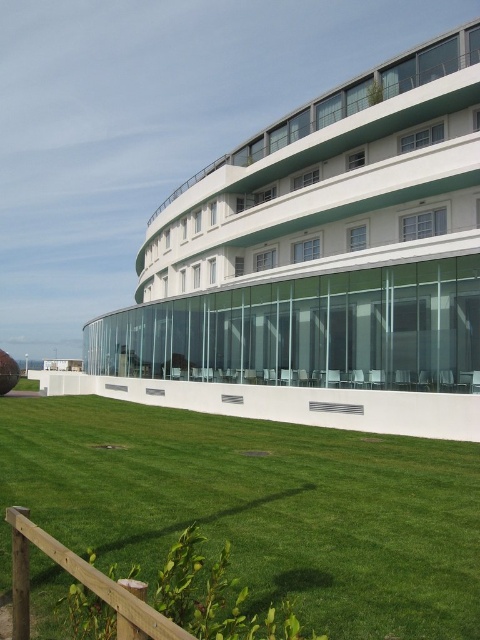
Who is higher up, white glass building at center or green grass at lower center?

Positioned higher is white glass building at center.

Who is more forward, (478, 92) or (308, 600)?

Positioned in front is point (308, 600).

Who is more distant from viewer, (391, 310) or (360, 616)?

Point (391, 310)

Locate an element on the screen. Image resolution: width=480 pixels, height=640 pixels. white glass building at center is located at coordinates (324, 257).